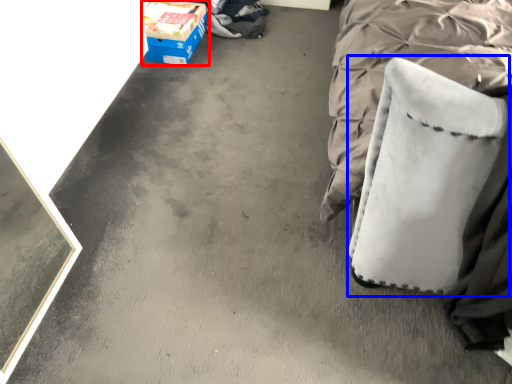
Question: Which object appears farthest to the camera in this image, box (highlighted by a red box) or swivel chair (highlighted by a blue box)?

Choices:
 (A) box
 (B) swivel chair

Answer: (A)